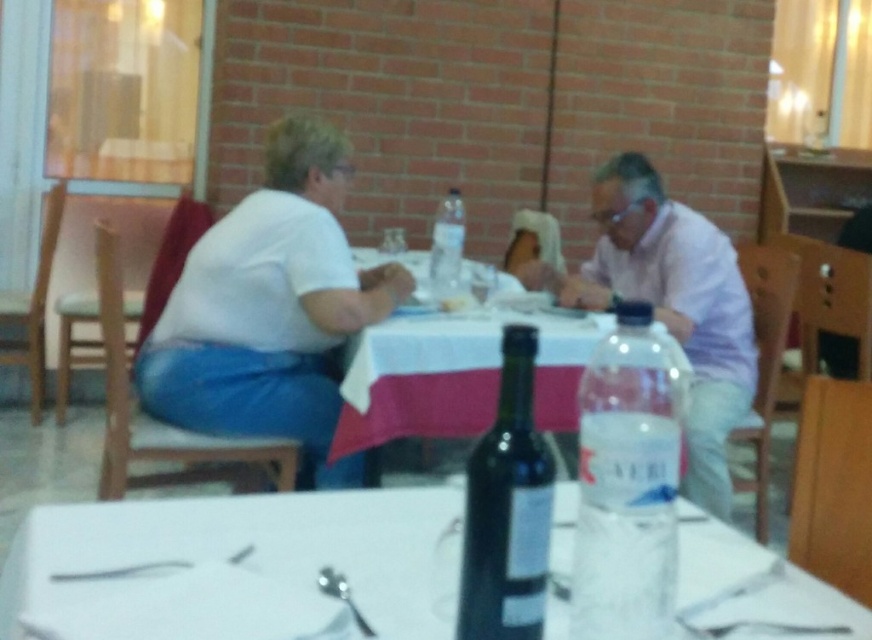
Question: Which point is farther to the camera?

Choices:
 (A) click(467, 314)
 (B) click(621, 308)
 (C) click(703, 554)
 (D) click(464, 552)

Answer: (A)

Question: Is white cloth table at center positioned in front of clear plastic bottle at center?

Choices:
 (A) no
 (B) yes

Answer: (B)

Question: Which of the following is the farthest from the observer?

Choices:
 (A) pos(288,186)
 (B) pos(445,211)
 (C) pos(439,419)
 (D) pos(484,465)

Answer: (B)

Question: Which point is farther from the camera taking this photo?

Choices:
 (A) (x=404, y=406)
 (B) (x=646, y=600)
 (C) (x=339, y=580)
 (D) (x=689, y=218)

Answer: (D)

Question: Does white paper napkin at center have a lesser width compared to silver spoon at lower center?

Choices:
 (A) no
 (B) yes

Answer: (A)

Question: Does pink fabric shirt at upper right appear on the left side of white cloth table at center?

Choices:
 (A) yes
 (B) no

Answer: (B)